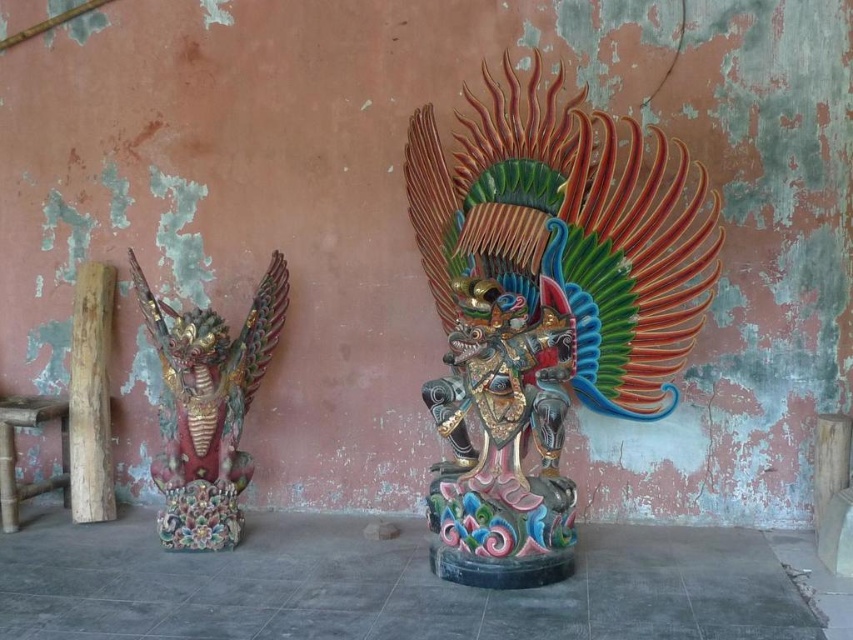
Can you confirm if multicolored painted statue at center is positioned to the right of bamboo stool at left?

Correct, you'll find multicolored painted statue at center to the right of bamboo stool at left.

Does multicolored painted statue at center appear over bamboo stool at left?

Yes.

Does point (440, 529) lie behind point (61, 470)?

No, (440, 529) is in front of (61, 470).

At what (x,y) coordinates should I click in order to perform the action: click on multicolored painted statue at center. Please return your answer as a coordinate pair (x, y). This screenshot has width=853, height=640. Looking at the image, I should click on (544, 310).

Is natural wood log at left wider than bamboo stool at left?

No.

Identify the location of natural wood log at left. (91, 396).

Find the location of `natural wood log at left`. natural wood log at left is located at coordinates (91, 396).

Can you confirm if polychrome wood carving at left is taller than bamboo stool at left?

Yes, polychrome wood carving at left is taller than bamboo stool at left.

Is point (169, 308) more distant than point (3, 518)?

No, (169, 308) is in front of (3, 518).

Which is in front, point (242, 360) or point (4, 456)?

Point (242, 360)

This screenshot has width=853, height=640. What are the coordinates of `polychrome wood carving at left` in the screenshot? It's located at (207, 406).